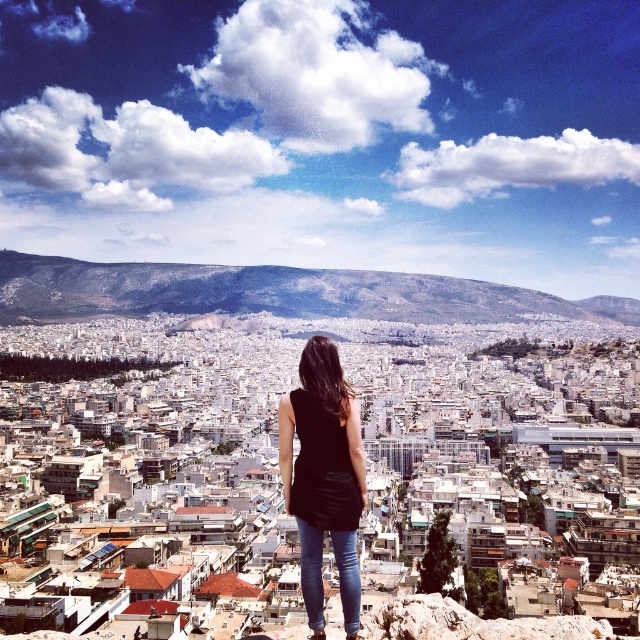
Can you confirm if gray rocky mountain at center is positioned to the left of black matte tank top at center?

Indeed, gray rocky mountain at center is positioned on the left side of black matte tank top at center.

Is point (320, 291) farther from camera compared to point (323, 480)?

That is True.

Locate an element on the screen. The height and width of the screenshot is (640, 640). gray rocky mountain at center is located at coordinates (272, 292).

Does point (326, 520) lie behind point (352, 624)?

That is True.

Between black matte tank top at center and jeans at center, which one is positioned higher?

black matte tank top at center

Who is more distant from viewer, (310, 369) or (320, 531)?

The point (310, 369) is more distant.

Identify the location of black matte tank top at center. (323, 476).

Who is more distant from viewer, (252,288) or (339,545)?

The point (252,288) is more distant.

Who is more forward, (305, 298) or (307, 534)?

Point (307, 534) is more forward.

Image resolution: width=640 pixels, height=640 pixels. What are the coordinates of `gray rocky mountain at center` in the screenshot? It's located at (272, 292).

Identify the location of gray rocky mountain at center. This screenshot has width=640, height=640. (272, 292).